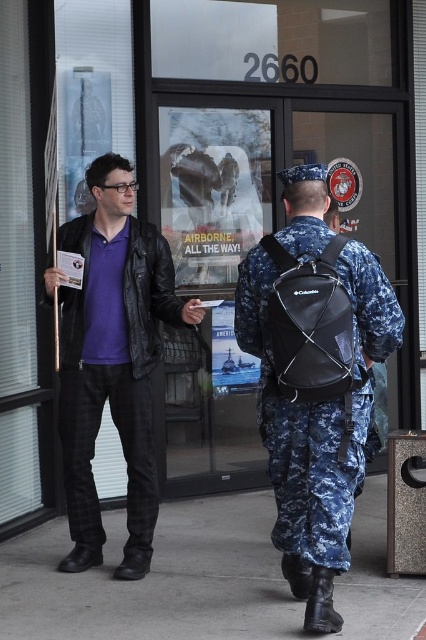
Is gray concrete pavement at lower center to the right of navy blue camouflage uniform at right from the viewer's perspective?

Incorrect, gray concrete pavement at lower center is not on the right side of navy blue camouflage uniform at right.

Between point (129, 604) and point (359, 243), which one is positioned behind?

Point (359, 243)

Who is more forward, (184, 612) or (316, 248)?

Point (316, 248) is in front.

Image resolution: width=426 pixels, height=640 pixels. What are the coordinates of `gray concrete pavement at lower center` in the screenshot? It's located at (201, 579).

Does gray concrete pavement at lower center appear on the right side of matte black jacket at center?

Correct, you'll find gray concrete pavement at lower center to the right of matte black jacket at center.

Which is above, gray concrete pavement at lower center or matte black jacket at center?

matte black jacket at center is higher up.

The width and height of the screenshot is (426, 640). Identify the location of gray concrete pavement at lower center. (201, 579).

Which of these two, matte black jacket at center or navy blue camouflage uniform at right, stands shorter?

navy blue camouflage uniform at right

Can you confirm if matte black jacket at center is positioned above navy blue camouflage uniform at right?

Yes.

Find the location of a particular element. Image resolution: width=426 pixels, height=640 pixels. matte black jacket at center is located at coordinates (114, 360).

Where is `matte black jacket at center`? Image resolution: width=426 pixels, height=640 pixels. matte black jacket at center is located at coordinates (114, 360).